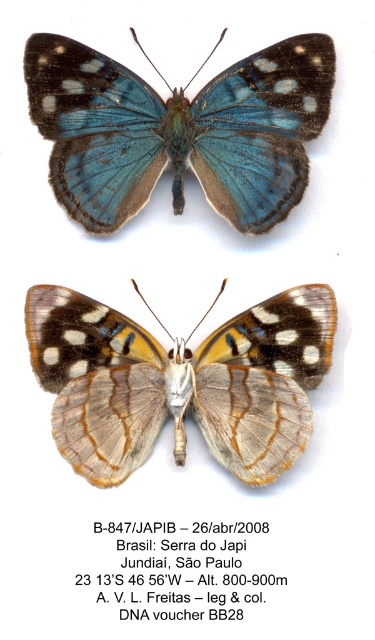
Question: Which of the following is the farthest from the observer?

Choices:
 (A) translucent silver butterfly at center
 (B) blue iridescent wings at center

Answer: (A)

Question: Which of the following is the closest to the observer?

Choices:
 (A) (136, 116)
 (B) (249, 348)

Answer: (A)

Question: Is blue iridescent wings at center positioned at the back of translucent silver butterfly at center?

Choices:
 (A) yes
 (B) no

Answer: (B)

Question: Does blue iridescent wings at center have a larger size compared to translucent silver butterfly at center?

Choices:
 (A) yes
 (B) no

Answer: (A)

Question: Can you confirm if blue iridescent wings at center is positioned to the right of translucent silver butterfly at center?

Choices:
 (A) no
 (B) yes

Answer: (A)